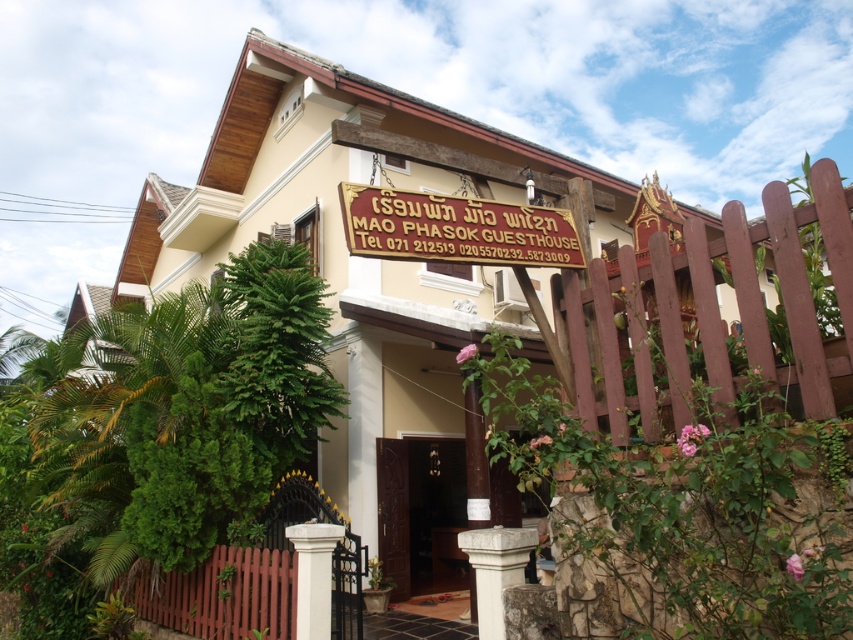
This screenshot has width=853, height=640. I want to click on brown wooden fence at lower left, so click(260, 577).

Who is taller, brown wooden fence at lower left or gold wood signboard at center?

Standing taller between the two is brown wooden fence at lower left.

Which is behind, point (161, 586) or point (366, 205)?

The point (161, 586) is behind.

Locate an element on the screen. Image resolution: width=853 pixels, height=640 pixels. brown wooden fence at lower left is located at coordinates (260, 577).

Between gold wood signboard at center and dark wood door at center, which one is positioned lower?

dark wood door at center

This screenshot has width=853, height=640. Describe the element at coordinates (456, 228) in the screenshot. I see `gold wood signboard at center` at that location.

At what (x,y) coordinates should I click in order to perform the action: click on gold wood signboard at center. Please return your answer as a coordinate pair (x, y). This screenshot has height=640, width=853. Looking at the image, I should click on (456, 228).

Is brown wooden fence at right to the left of dark wood door at center from the viewer's perspective?

Incorrect, brown wooden fence at right is not on the left side of dark wood door at center.

Consider the image. Who is shorter, brown wooden fence at right or dark wood door at center?

With less height is brown wooden fence at right.

Measure the distance between point (660, 260) and camera.

They are 4.55 meters apart.

I want to click on brown wooden fence at right, so click(715, 308).